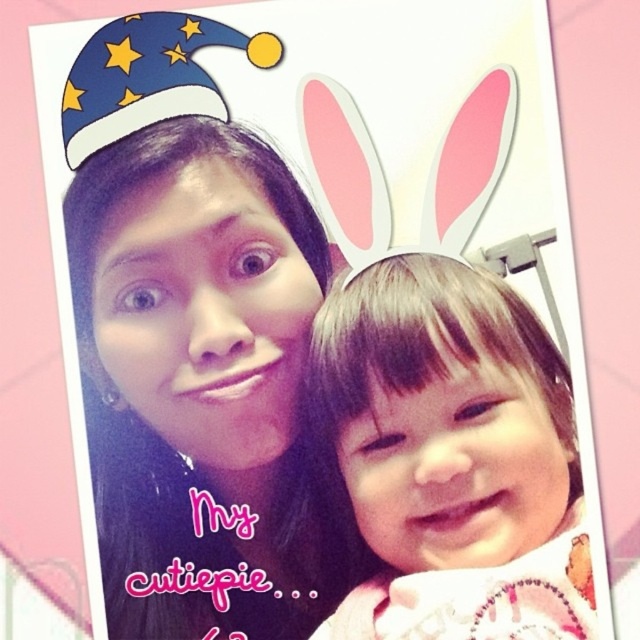
Question: Which point is closer to the camera taking this photo?

Choices:
 (A) (554, 625)
 (B) (138, 598)

Answer: (A)

Question: Among these objects, which one is farthest from the camera?

Choices:
 (A) matte black hair at center
 (B) smooth skin baby at center

Answer: (A)

Question: Is matte black hair at center closer to the viewer compared to smooth skin baby at center?

Choices:
 (A) yes
 (B) no

Answer: (B)

Question: In this image, where is matte black hair at center located relative to smooth skin baby at center?

Choices:
 (A) below
 (B) above

Answer: (B)

Question: Is matte black hair at center closer to camera compared to smooth skin baby at center?

Choices:
 (A) no
 (B) yes

Answer: (A)

Question: Which point is closer to the camera?

Choices:
 (A) smooth skin baby at center
 (B) matte black hair at center

Answer: (A)